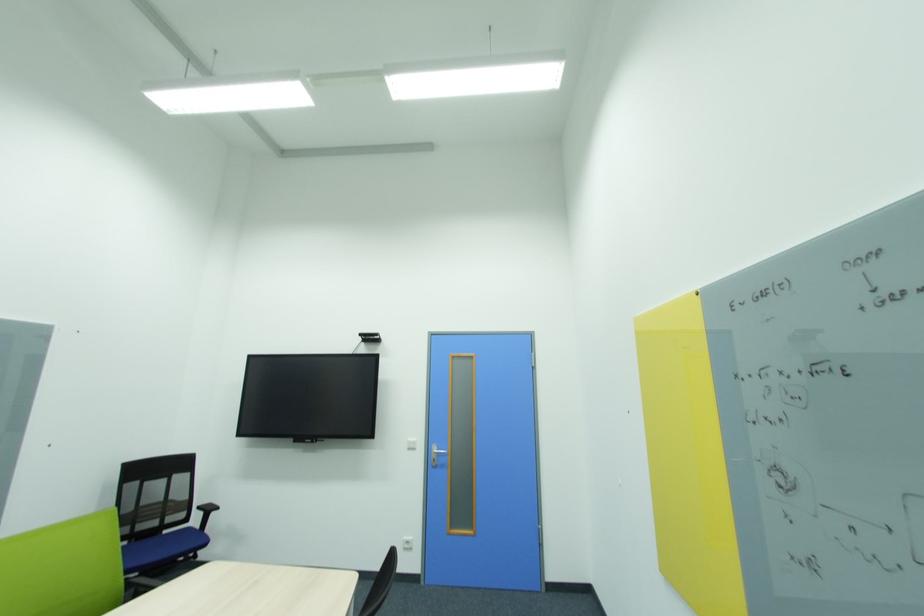
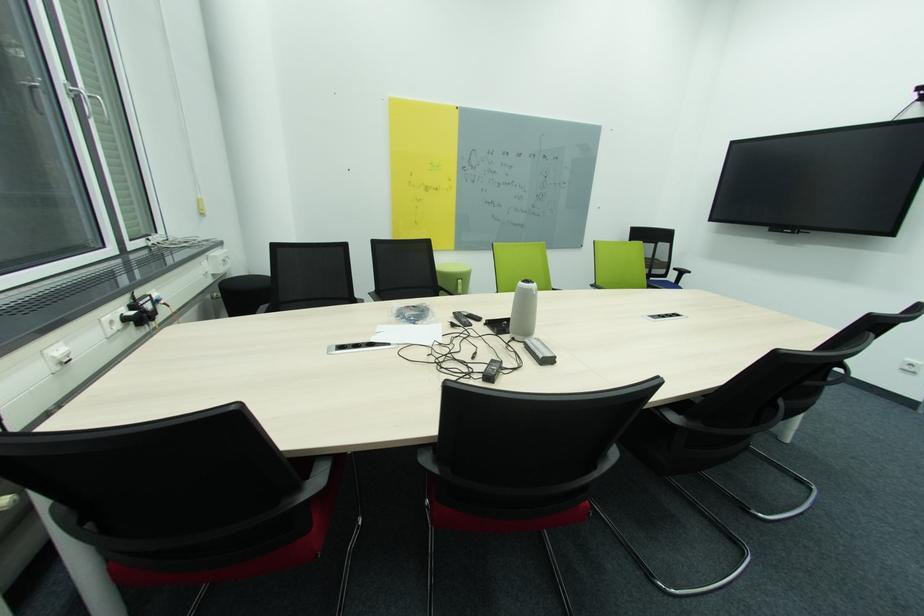
Based on the photo, how did the camera likely rotate?

The camera rotated toward left-down.